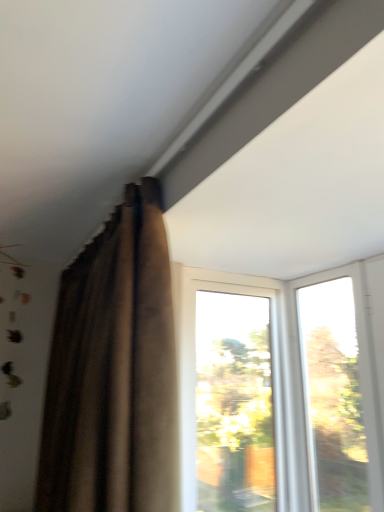
In order to face transparent glass window at upper right, which ranks as the first window in right-to-left order, should I rotate leftwards or rightwards?

It's best to rotate right around 18.024 degrees.

Measure the distance between transparent glass window at center, placed as the 2th window when sorted from right to left, and camera.

They are 5.26 feet apart.

Where is `transparent glass window at upper right, which appears as the second window when viewed from the left`? The height and width of the screenshot is (512, 384). transparent glass window at upper right, which appears as the second window when viewed from the left is located at coordinates (340, 395).

How different are the orientations of brown velvet curtain at upper left and transparent glass window at upper right, which ranks as the first window in right-to-left order, in degrees?

There is a 0.187-degree angle between the facing directions of brown velvet curtain at upper left and transparent glass window at upper right, which ranks as the first window in right-to-left order.

In the scene shown: Can you confirm if brown velvet curtain at upper left is positioned to the left of transparent glass window at upper right, which ranks as the first window in right-to-left order?

Yes, brown velvet curtain at upper left is to the left of transparent glass window at upper right, which ranks as the first window in right-to-left order.

Is brown velvet curtain at upper left taller than transparent glass window at upper right, which appears as the second window when viewed from the left?

Indeed, brown velvet curtain at upper left has a greater height compared to transparent glass window at upper right, which appears as the second window when viewed from the left.

Considering the sizes of objects brown velvet curtain at upper left and transparent glass window at upper right, which appears as the second window when viewed from the left, in the image provided, who is wider, brown velvet curtain at upper left or transparent glass window at upper right, which appears as the second window when viewed from the left,?

brown velvet curtain at upper left.

From a real-world perspective, is transparent glass window at center, which appears as the first window when viewed from the left, located beneath brown velvet curtain at upper left?

Yes, from a real-world perspective, transparent glass window at center, which appears as the first window when viewed from the left, is below brown velvet curtain at upper left.

Is transparent glass window at center, placed as the 2th window when sorted from right to left, spatially inside brown velvet curtain at upper left, or outside of it?

transparent glass window at center, placed as the 2th window when sorted from right to left, is not inside brown velvet curtain at upper left, it's outside.

From the image's perspective, between transparent glass window at center, which appears as the first window when viewed from the left, and brown velvet curtain at upper left, which one is located above?

brown velvet curtain at upper left.

Is transparent glass window at upper right, which appears as the second window when viewed from the left, oriented away from transparent glass window at center, which appears as the first window when viewed from the left?

No.

From the image's perspective, which is below, transparent glass window at upper right, which ranks as the first window in right-to-left order, or transparent glass window at center, which appears as the first window when viewed from the left?

transparent glass window at center, which appears as the first window when viewed from the left, is shown below in the image.

Could you measure the distance between transparent glass window at upper right, which ranks as the first window in right-to-left order, and transparent glass window at center, placed as the 2th window when sorted from right to left?

transparent glass window at upper right, which ranks as the first window in right-to-left order, is 31.44 centimeters from transparent glass window at center, placed as the 2th window when sorted from right to left.

Which is more to the left, transparent glass window at upper right, which appears as the second window when viewed from the left, or transparent glass window at center, placed as the 2th window when sorted from right to left?

From the viewer's perspective, transparent glass window at center, placed as the 2th window when sorted from right to left, appears more on the left side.

Choose the correct answer: Is transparent glass window at center, placed as the 2th window when sorted from right to left, inside transparent glass window at upper right, which ranks as the first window in right-to-left order, or outside it?

transparent glass window at center, placed as the 2th window when sorted from right to left, is located beyond the bounds of transparent glass window at upper right, which ranks as the first window in right-to-left order.

Considering the relative sizes of transparent glass window at center, which appears as the first window when viewed from the left, and transparent glass window at upper right, which appears as the second window when viewed from the left, in the image provided, is transparent glass window at center, which appears as the first window when viewed from the left, thinner than transparent glass window at upper right, which appears as the second window when viewed from the left,?

In fact, transparent glass window at center, which appears as the first window when viewed from the left, might be wider than transparent glass window at upper right, which appears as the second window when viewed from the left.

Is transparent glass window at center, placed as the 2th window when sorted from right to left, oriented away from transparent glass window at upper right, which appears as the second window when viewed from the left?

No.

Could you measure the distance between transparent glass window at center, placed as the 2th window when sorted from right to left, and transparent glass window at upper right, which appears as the second window when viewed from the left?

A distance of 12.38 inches exists between transparent glass window at center, placed as the 2th window when sorted from right to left, and transparent glass window at upper right, which appears as the second window when viewed from the left.

From the picture: Is transparent glass window at upper right, which ranks as the first window in right-to-left order, bigger or smaller than brown velvet curtain at upper left?

transparent glass window at upper right, which ranks as the first window in right-to-left order, is smaller than brown velvet curtain at upper left.

In the image, is transparent glass window at upper right, which appears as the second window when viewed from the left, on the left side or the right side of brown velvet curtain at upper left?

In the image, transparent glass window at upper right, which appears as the second window when viewed from the left, appears on the right side of brown velvet curtain at upper left.

Can we say transparent glass window at upper right, which appears as the second window when viewed from the left, lies outside brown velvet curtain at upper left?

Yes.

Consider the image. Which point is more distant from viewer, (164, 296) or (232, 382)?

The point (232, 382) is more distant.

Based on the photo, in terms of width, does brown velvet curtain at upper left look wider or thinner when compared to transparent glass window at center, which appears as the first window when viewed from the left?

Considering their sizes, brown velvet curtain at upper left looks broader than transparent glass window at center, which appears as the first window when viewed from the left.

Which object is more forward, brown velvet curtain at upper left or transparent glass window at center, placed as the 2th window when sorted from right to left?

brown velvet curtain at upper left.

Is brown velvet curtain at upper left touching transparent glass window at center, which appears as the first window when viewed from the left?

No, brown velvet curtain at upper left is not beside transparent glass window at center, which appears as the first window when viewed from the left.

Where is `curtain above the transparent glass window at upper right, which appears as the second window when viewed from the left (from the image's perspective)`? curtain above the transparent glass window at upper right, which appears as the second window when viewed from the left (from the image's perspective) is located at coordinates (113, 371).

Find the location of a particular element. This screenshot has height=512, width=384. curtain that appears in front of the transparent glass window at center, placed as the 2th window when sorted from right to left is located at coordinates (113, 371).

Based on their spatial positions, is transparent glass window at upper right, which ranks as the first window in right-to-left order, or transparent glass window at center, placed as the 2th window when sorted from right to left, further from brown velvet curtain at upper left?

transparent glass window at upper right, which ranks as the first window in right-to-left order.

Looking at the image, which one is located further to transparent glass window at upper right, which appears as the second window when viewed from the left, transparent glass window at center, placed as the 2th window when sorted from right to left, or brown velvet curtain at upper left?

Among the two, brown velvet curtain at upper left is located further to transparent glass window at upper right, which appears as the second window when viewed from the left.

Estimate the real-world distances between objects in this image. Which object is closer to transparent glass window at center, which appears as the first window when viewed from the left, transparent glass window at upper right, which ranks as the first window in right-to-left order, or brown velvet curtain at upper left?

transparent glass window at upper right, which ranks as the first window in right-to-left order, is positioned closer to the anchor transparent glass window at center, which appears as the first window when viewed from the left.

Looking at the image, which one is located closer to brown velvet curtain at upper left, transparent glass window at center, placed as the 2th window when sorted from right to left, or transparent glass window at upper right, which appears as the second window when viewed from the left?

transparent glass window at center, placed as the 2th window when sorted from right to left.

Which object lies further to the anchor point transparent glass window at center, which appears as the first window when viewed from the left, brown velvet curtain at upper left or transparent glass window at upper right, which ranks as the first window in right-to-left order?

Among the two, brown velvet curtain at upper left is located further to transparent glass window at center, which appears as the first window when viewed from the left.

Looking at the image, which one is located further to transparent glass window at upper right, which appears as the second window when viewed from the left, brown velvet curtain at upper left or transparent glass window at center, which appears as the first window when viewed from the left?

brown velvet curtain at upper left is positioned further to the anchor transparent glass window at upper right, which appears as the second window when viewed from the left.

Find the location of `window between brown velvet curtain at upper left and transparent glass window at upper right, which ranks as the first window in right-to-left order, in the horizontal direction`. window between brown velvet curtain at upper left and transparent glass window at upper right, which ranks as the first window in right-to-left order, in the horizontal direction is located at coordinates (234, 400).